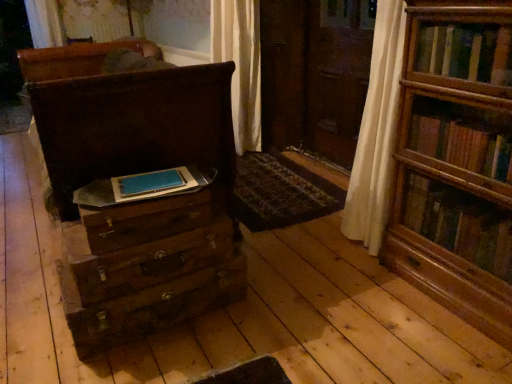
At what (x,y) coordinates should I click in order to perform the action: click on free space in front of patterned carpet at center. Please return your answer as a coordinate pair (x, y). Looking at the image, I should click on (302, 277).